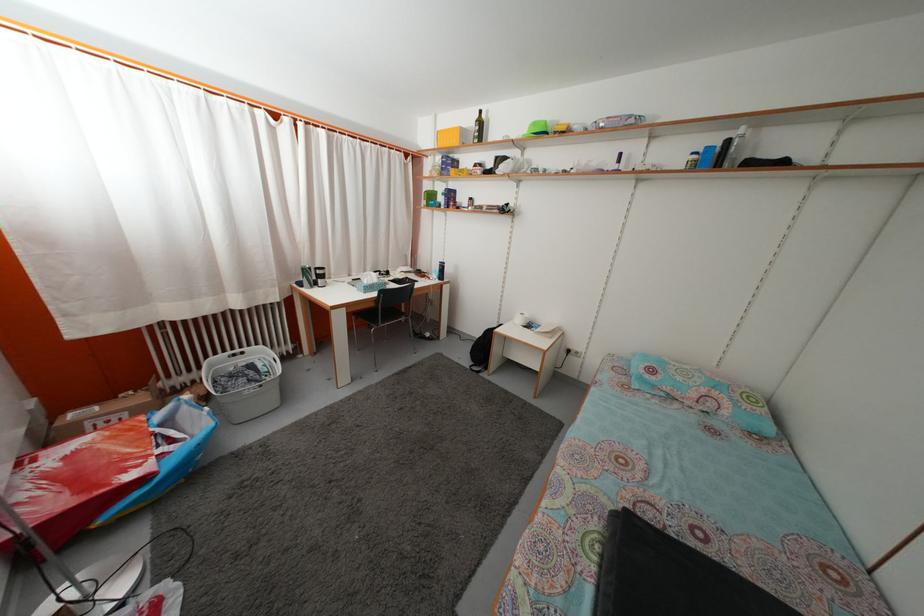
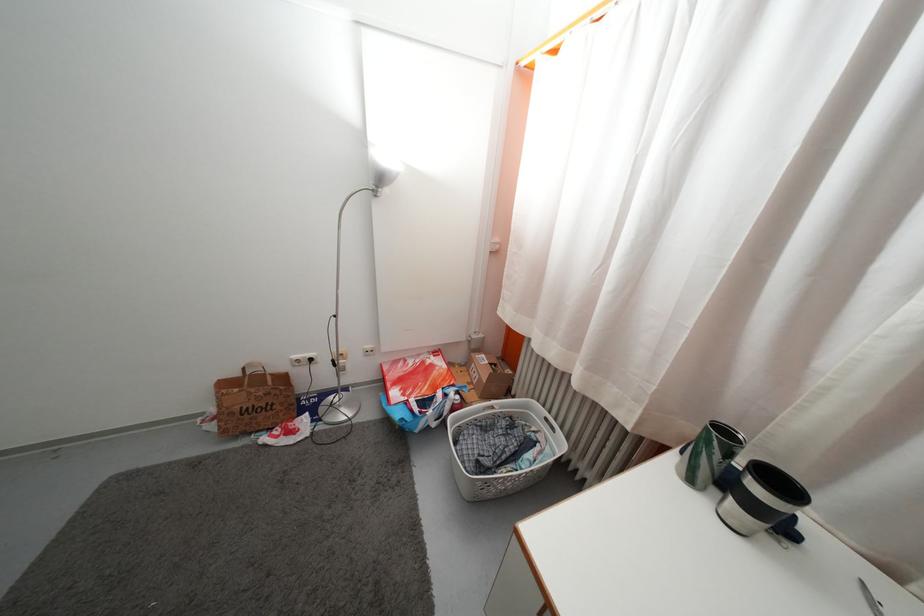
Where in the second image is the point corresponding to [317,294] from the first image?

(697, 488)